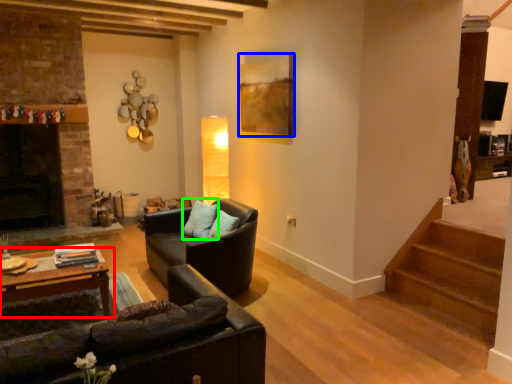
Question: Which object is positioned farthest from table (highlighted by a red box)? Select from picture frame (highlighted by a blue box) and pillow (highlighted by a green box).

Choices:
 (A) picture frame
 (B) pillow

Answer: (A)